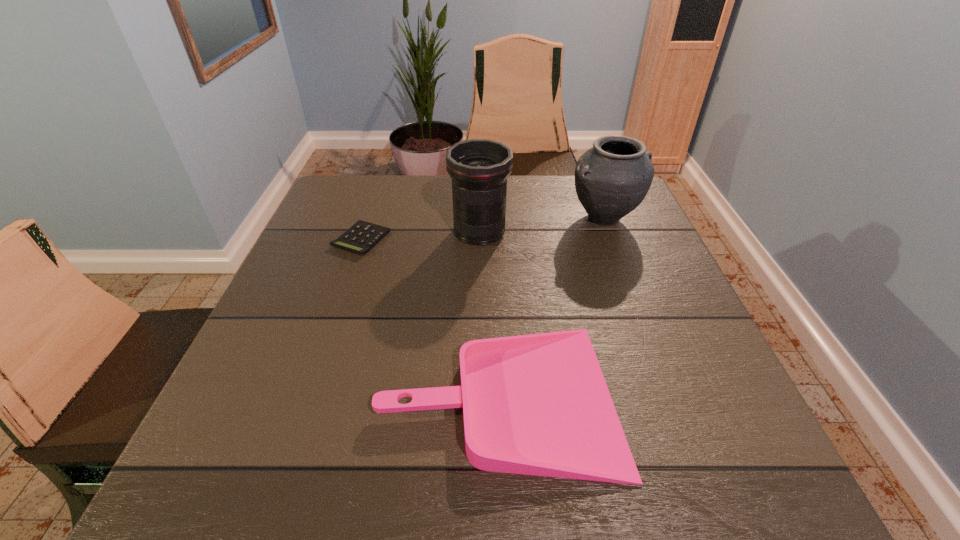
Locate an element on the screen. This screenshot has height=540, width=960. free space between the nearest object and the urn is located at coordinates (552, 307).

Image resolution: width=960 pixels, height=540 pixels. I want to click on vacant area that lies between the third tallest object and the telephoto lens, so click(489, 314).

This screenshot has width=960, height=540. Find the location of `the third closest object to the telephoto lens`. the third closest object to the telephoto lens is located at coordinates (538, 404).

Where is `object that is the third closest one to the nearest object`? The width and height of the screenshot is (960, 540). object that is the third closest one to the nearest object is located at coordinates (612, 178).

Locate an element on the screen. This screenshot has width=960, height=540. vacant region that satisfies the following two spatial constraints: 1. on the back side of the telephoto lens; 2. on the left side of the urn is located at coordinates (479, 218).